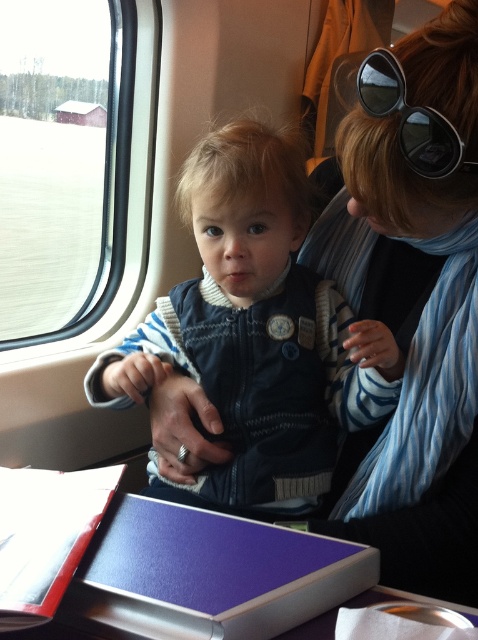
Question: Which point is farther from the camera taking this photo?

Choices:
 (A) (118, 60)
 (B) (198, 166)

Answer: (A)

Question: Does matte blue vest at center have a smaller size compared to black reflective sunglasses at upper right?

Choices:
 (A) no
 (B) yes

Answer: (A)

Question: Is transparent glass window at upper left further to the viewer compared to black reflective sunglasses at upper right?

Choices:
 (A) no
 (B) yes

Answer: (B)

Question: Which object is positioned farthest from the black reflective sunglasses at upper right?

Choices:
 (A) transparent glass window at upper left
 (B) matte blue vest at center

Answer: (A)

Question: Does transparent glass window at upper left have a greater width compared to black reflective sunglasses at upper right?

Choices:
 (A) yes
 (B) no

Answer: (A)

Question: Which object is positioned closest to the transparent glass window at upper left?

Choices:
 (A) matte blue vest at center
 (B) black reflective sunglasses at upper right

Answer: (A)